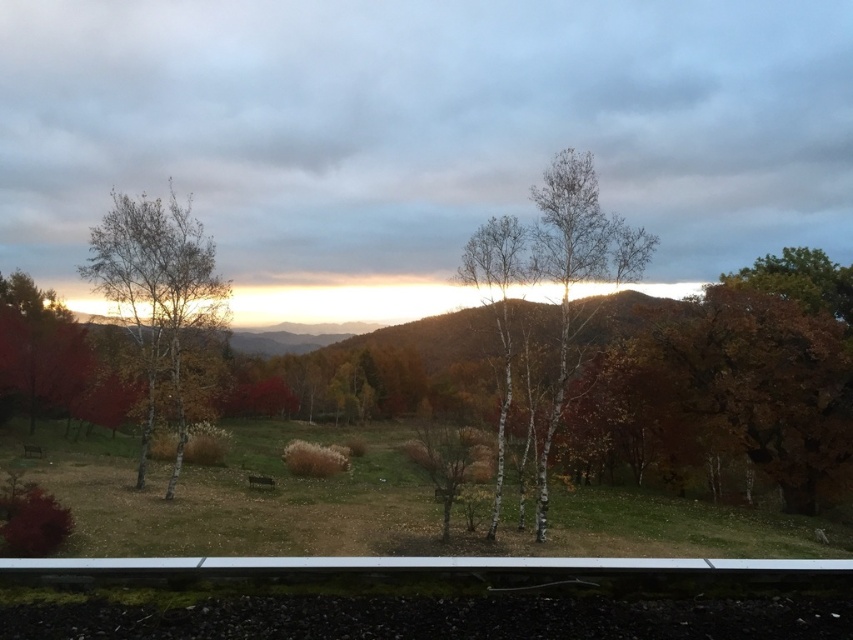
You are planning to plant a new tree in your backyard. You have two options from the image shown. The shiny red tree at left is known to grow to 20 feet tall, while the white bark trees at center reach 40 feet tall. Given their spacing in the image, which tree would you choose to ensure it has enough space to grow without overcrowding the area?

The shiny red tree at left grows to 20 feet tall and the white bark trees at center reach 40 feet tall. Since they are 106.35 feet apart, both trees have sufficient space to grow without overcrowding. However, if you want to maximize space efficiency while ensuring proper growth, the shiny red tree at left may be a better choice as it requires less horizontal space relative to its height compared to the taller white bark trees at center.

You are an artist setting up your easel to paint the scene. You want to capture the smooth white birch at left and white bark trees at center. Which of these two objects should you focus on first if you want to paint them in the order they appear closest to farthest from your viewpoint?

The smooth white birch at left is positioned over white bark trees at center, so it is closer to you. Therefore, you should focus on painting the smooth white birch at left first before moving to the white bark trees at center which are farther away.